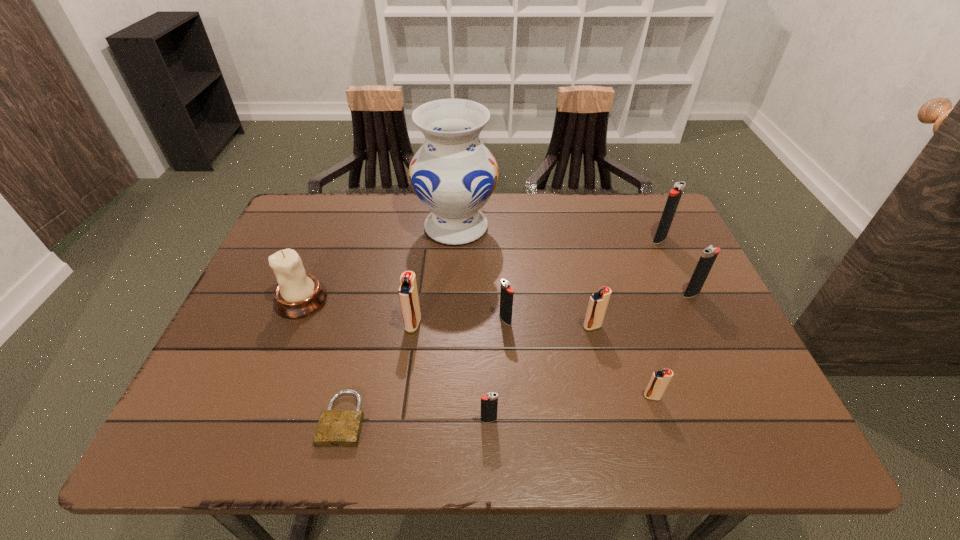
At what (x,y) coordinates should I click in order to perform the action: click on igniter that is at the far edge. Please return your answer as a coordinate pair (x, y). Image resolution: width=960 pixels, height=540 pixels. Looking at the image, I should click on (675, 194).

Locate an element on the screen. The height and width of the screenshot is (540, 960). igniter at the near edge is located at coordinates (489, 403).

Where is `padlock that is at the near edge`? The image size is (960, 540). padlock that is at the near edge is located at coordinates (336, 428).

Find the location of a particular element. The image size is (960, 540). object located at the left edge is located at coordinates (297, 295).

Locate an element on the screen. The width and height of the screenshot is (960, 540). object at the far right corner is located at coordinates (675, 194).

What are the coordinates of `free spot at the far edge of the desktop` in the screenshot? It's located at (410, 211).

At what (x,y) coordinates should I click in order to perform the action: click on vacant point at the near edge. Please return your answer as a coordinate pair (x, y). This screenshot has height=540, width=960. Looking at the image, I should click on (653, 434).

Where is `vacant space at the left edge of the desktop`? Image resolution: width=960 pixels, height=540 pixels. vacant space at the left edge of the desktop is located at coordinates (240, 341).

Image resolution: width=960 pixels, height=540 pixels. What are the coordinates of `vacant region at the right edge of the desktop` in the screenshot? It's located at (673, 338).

Identify the location of free spot at the far left corner of the desktop. The image size is (960, 540). (326, 211).